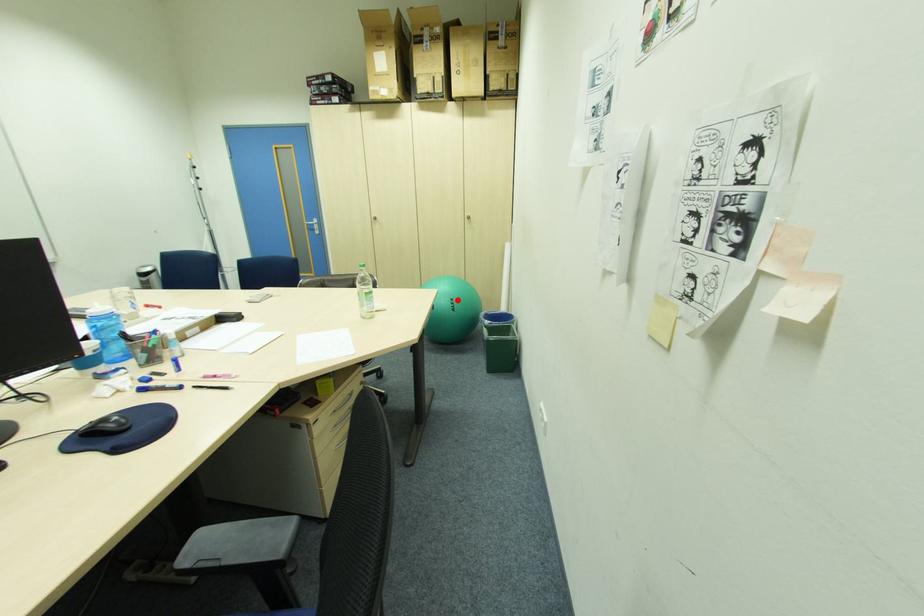
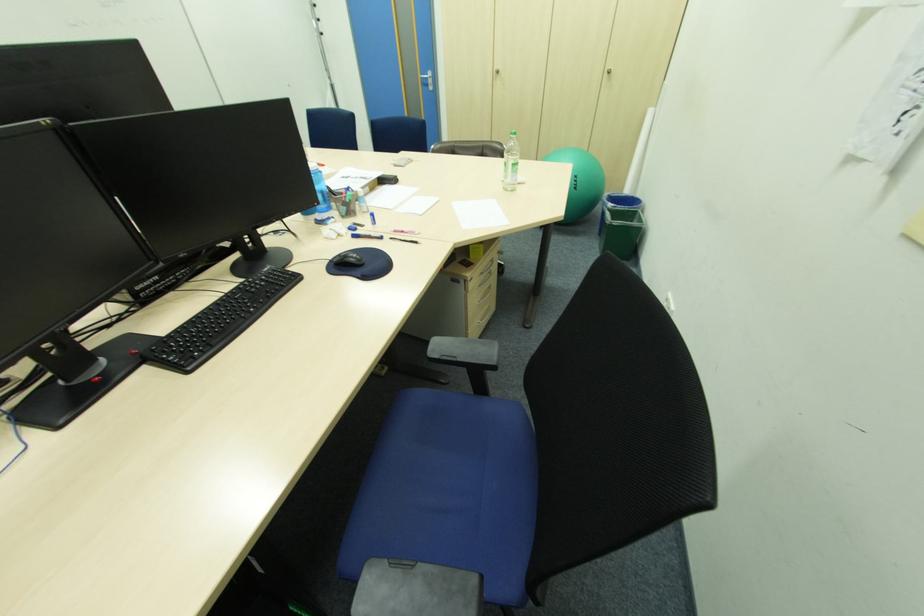
Question: I am providing you with two images of the same scene from different viewpoints. Image1 has a red point marked. In image2, the corresponding 3D location appears at what relative position? Reply with the corresponding letter.

Choices:
 (A) Closer
 (B) Farther

Answer: (A)